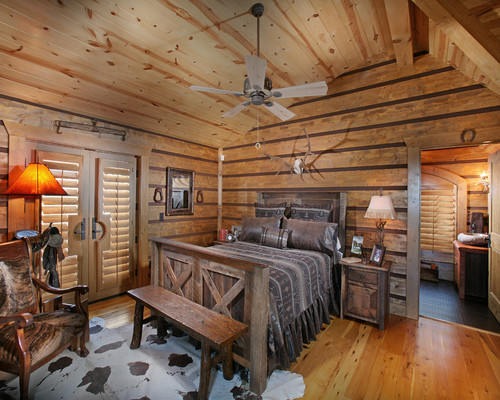
Locate an element on the screen. chair is located at coordinates click(x=46, y=322).